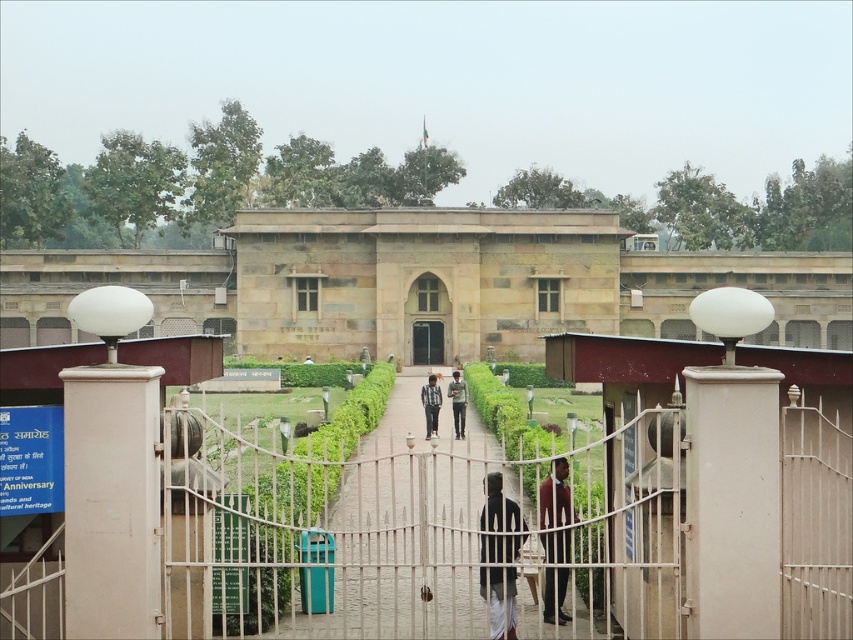
Question: Is stone/rough stone building at center bigger than dark gray fabric at center?

Choices:
 (A) no
 (B) yes

Answer: (B)

Question: Which of the following is the closest to the observer?

Choices:
 (A) dark glass door at center
 (B) dark gray fabric at center
 (C) green fabric shirt at center
 (D) maroon fabric shirt at center

Answer: (D)

Question: Can you confirm if maroon fabric shirt at center is wider than dark glass door at center?

Choices:
 (A) no
 (B) yes

Answer: (A)

Question: Which object is positioned closest to the stone/rough stone building at center?

Choices:
 (A) maroon fabric shirt at center
 (B) green fabric shirt at center

Answer: (B)

Question: Can you confirm if stone/rough stone building at center is smaller than dark gray fabric at center?

Choices:
 (A) no
 (B) yes

Answer: (A)

Question: Which point appears farthest from the camera in this image?

Choices:
 (A) (561, 554)
 (B) (463, 406)
 (C) (299, 211)

Answer: (C)